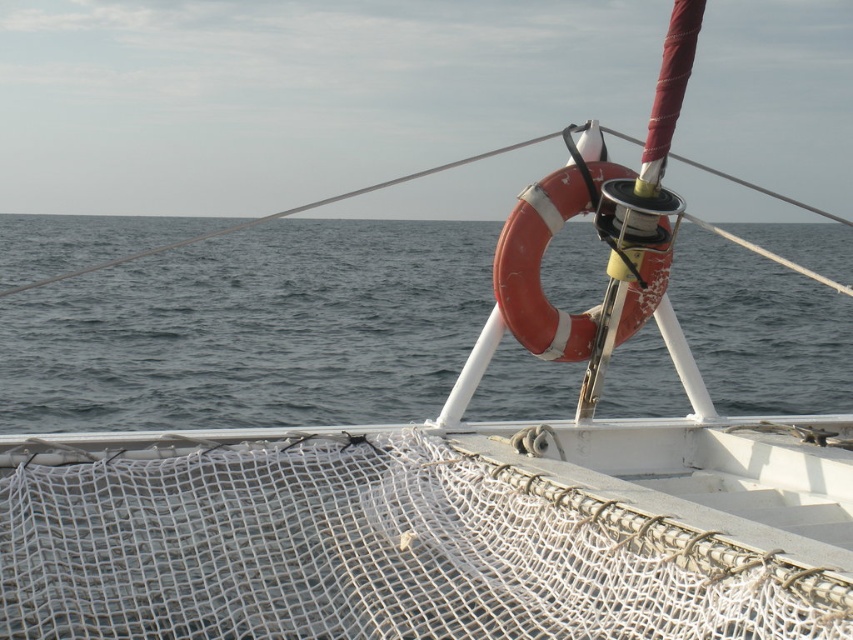
Does white mesh net at center have a larger size compared to gray matte water at center?

No, white mesh net at center is not bigger than gray matte water at center.

Which of these two, white mesh net at center or gray matte water at center, stands taller?

gray matte water at center is taller.

Which is behind, point (283, 540) or point (166, 301)?

Positioned behind is point (166, 301).

This screenshot has height=640, width=853. In order to click on white mesh net at center in this screenshot , I will do `click(418, 536)`.